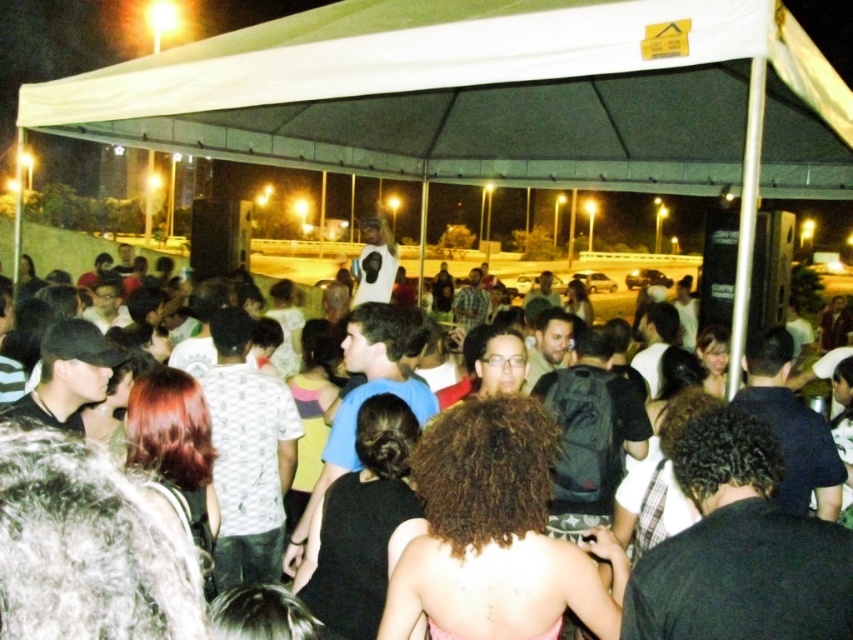
You are a photographer trying to capture a clear shot of the white fabric canopy at upper center during the event. However, there is a black fabric crowd at center in the way. Based on their positions, can you still see the canopy through the crowd?

The black fabric crowd at center is behind the white fabric canopy at upper center, so yes, you can still see the white fabric canopy at upper center as it is in front of the crowd.

You are planning to set up a new tent for an event and want to ensure there is enough space under the white fabric canopy at upper center for the black fabric crowd at center. Can the crowd fit comfortably under the canopy?

The white fabric canopy at upper center is wider than the black fabric crowd at center, so the crowd can fit comfortably under the canopy.

You are standing at the entrance of the event and want to find the white fabric canopy at upper center. According to the coordinates provided, where should you look relative to your current position?

The white fabric canopy at upper center is located at point 0.150 on the horizontal axis and 0.572 on the vertical axis. To locate it, face forward and look slightly to the left horizontally and directly ahead vertically.